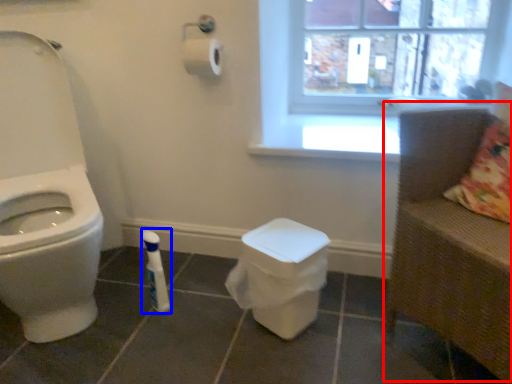
Question: Which object is further to the camera taking this photo, armchair (highlighted by a red box) or toiletry (highlighted by a blue box)?

Choices:
 (A) armchair
 (B) toiletry

Answer: (B)